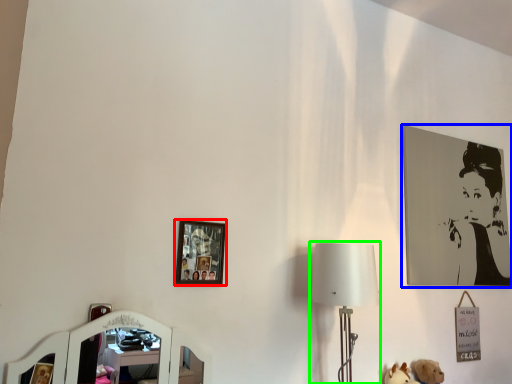
Question: Which object is the closest to the picture frame (highlighted by a red box)? Choose among these: picture frame (highlighted by a blue box) or table lamp (highlighted by a green box).

Choices:
 (A) picture frame
 (B) table lamp

Answer: (B)